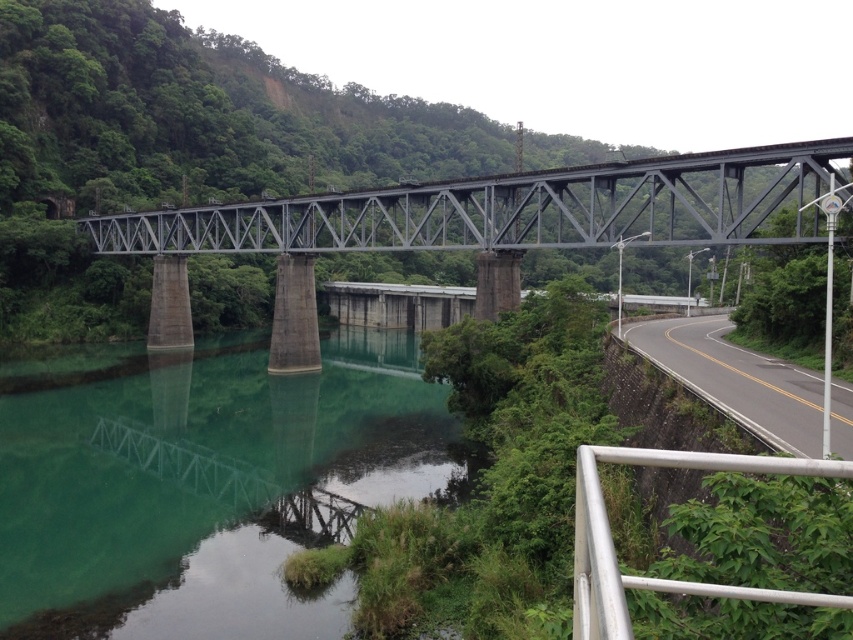
You are a delivery driver who needs to safely navigate a truck that is 12 feet wide through the area near the black asphalt road at lower right and the silver metallic railing at lower right. Based on the scene, can your truck fit between them without touching either the road or the railing?

The distance between the black asphalt road at lower right and the silver metallic railing at lower right is 42.08 feet. Since your truck is only 12 feet wide, it can safely pass through the space between them without touching either the road or the railing.

You are a delivery truck driver who needs to cross the bridge. You notice the green concrete river at center and the black asphalt road at lower right. Which one is wider? Please choose between the two.

The green concrete river at center is wider than the black asphalt road at lower right according to the description.